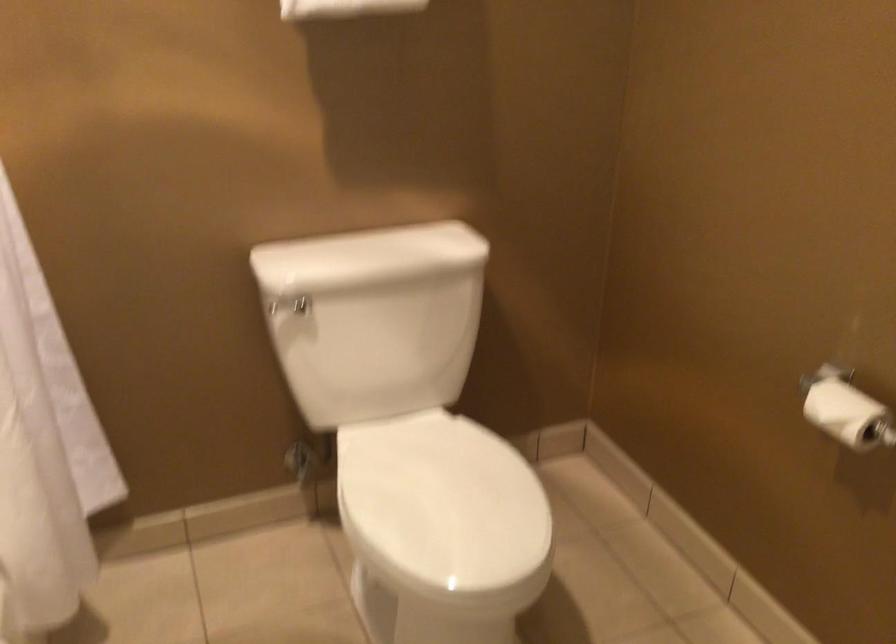
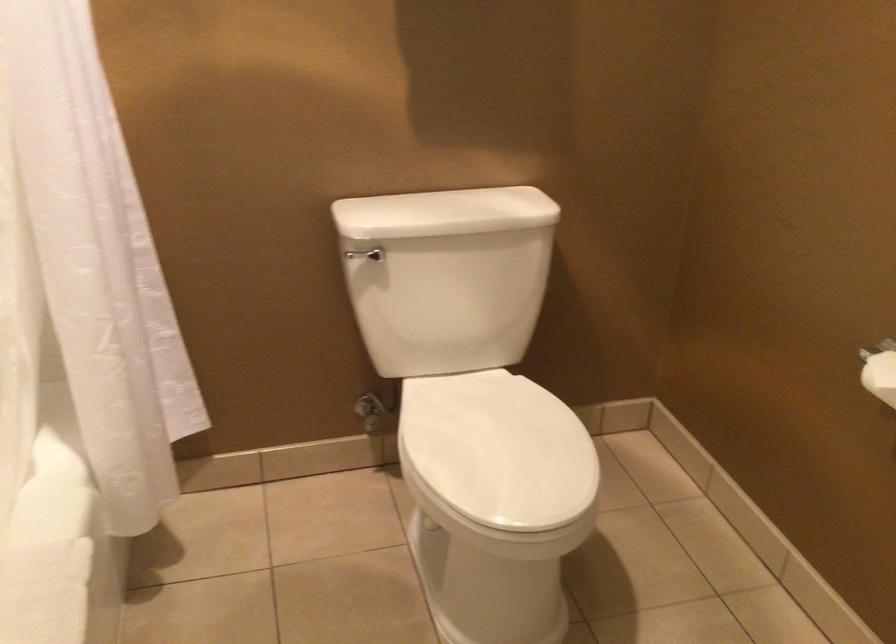
Where in the second image is the point corresponding to the point at 289,305 from the first image?

(365, 254)